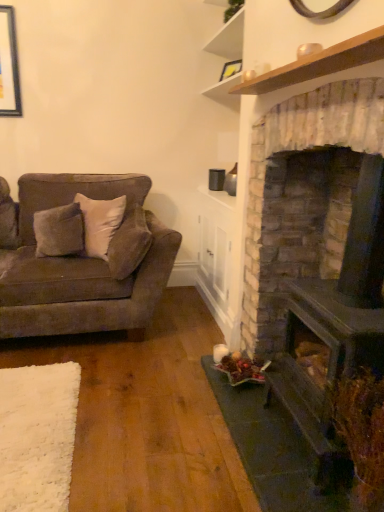
Question: Does point (127, 210) appear closer or farther from the camera than point (153, 276)?

Choices:
 (A) closer
 (B) farther

Answer: (B)

Question: In the image, is suede-like beige pillow at center-left positioned in front of or behind suede-like brown couch at left?

Choices:
 (A) behind
 (B) front

Answer: (A)

Question: Considering the real-world distances, which object is closest to the dark brown stone fireplace at right?

Choices:
 (A) suede-like brown couch at left
 (B) matte black picture frame at upper center
 (C) suede-like beige pillow at center-left

Answer: (C)

Question: Estimate the real-world distances between objects in this image. Which object is closer to the suede-like beige pillow at center-left?

Choices:
 (A) suede-like brown couch at left
 (B) dark brown stone fireplace at right
 (C) matte black picture frame at upper center

Answer: (A)